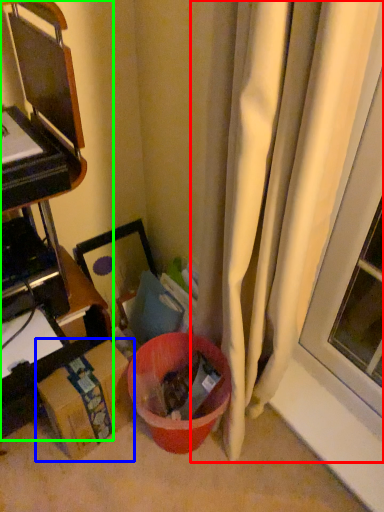
Question: Estimate the real-world distances between objects in this image. Which object is farther from curtain (highlighted by a red box), cardboard box (highlighted by a blue box) or furniture (highlighted by a green box)?

Choices:
 (A) cardboard box
 (B) furniture

Answer: (A)